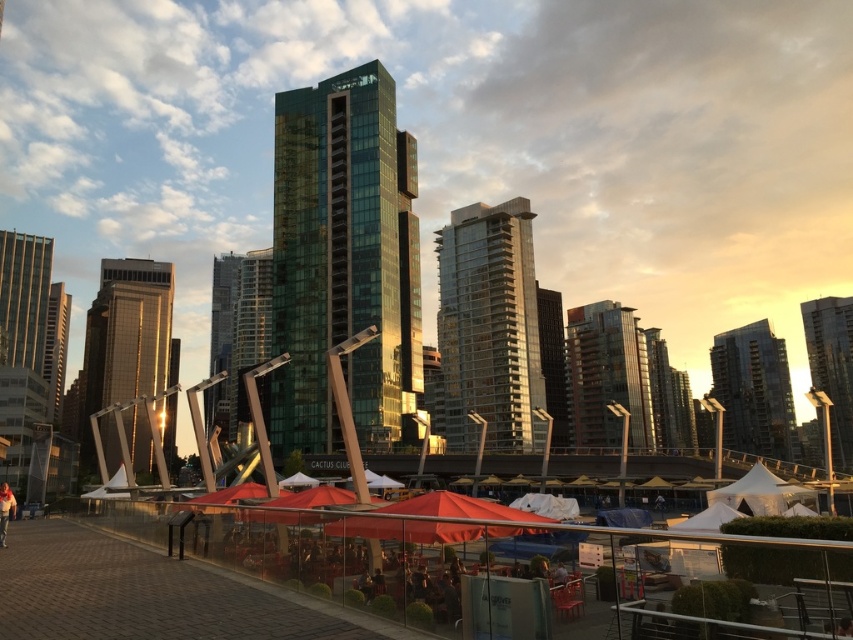
Between glassy reflective skyscraper at center and green glass skyscraper at center, which one appears on the left side from the viewer's perspective?

green glass skyscraper at center is more to the left.

Does glassy reflective skyscraper at center have a lesser width compared to green glass skyscraper at center?

Yes, glassy reflective skyscraper at center is thinner than green glass skyscraper at center.

Locate an element on the screen. glassy reflective skyscraper at center is located at coordinates (222, 337).

Between point (117, 461) and point (64, 371), which one is positioned in front?

Point (117, 461)

Who is positioned more to the right, shiny silver skyscraper at center or green glass skyscraper at center?

shiny silver skyscraper at center is more to the right.

Measure the distance between point (117, 305) and camera.

A distance of 200.00 meters exists between point (117, 305) and camera.

Where is `shiny silver skyscraper at center`? The image size is (853, 640). shiny silver skyscraper at center is located at coordinates (125, 339).

Can you confirm if glassy reflective building at right is shorter than glassy reflective skyscraper at center?

Indeed, glassy reflective building at right has a lesser height compared to glassy reflective skyscraper at center.

Locate an element on the screen. Image resolution: width=853 pixels, height=640 pixels. glassy reflective building at right is located at coordinates click(753, 392).

Identify the location of glassy reflective building at right. The width and height of the screenshot is (853, 640). (753, 392).